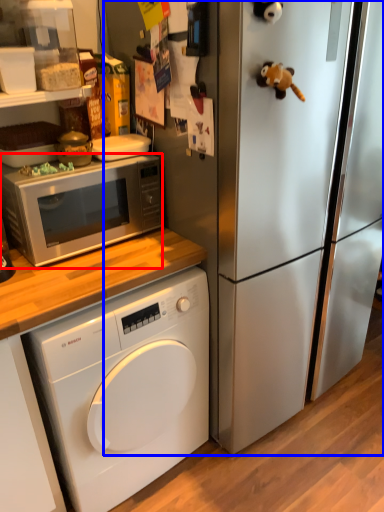
Question: Which object appears closest to the camera in this image, microwave oven (highlighted by a red box) or refrigerator (highlighted by a blue box)?

Choices:
 (A) microwave oven
 (B) refrigerator

Answer: (B)